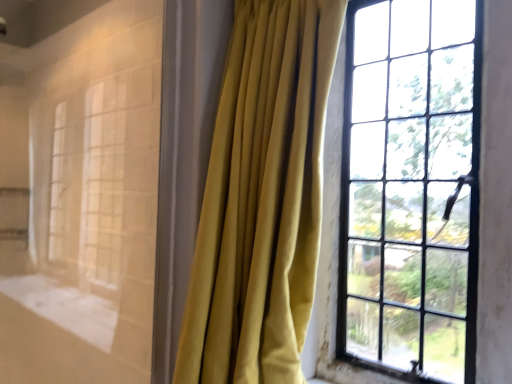
Identify the location of matte white tile at left. point(81,198).

Describe the element at coordinates (81, 198) in the screenshot. I see `matte white tile at left` at that location.

Find the location of a particular element. matte white tile at left is located at coordinates (81, 198).